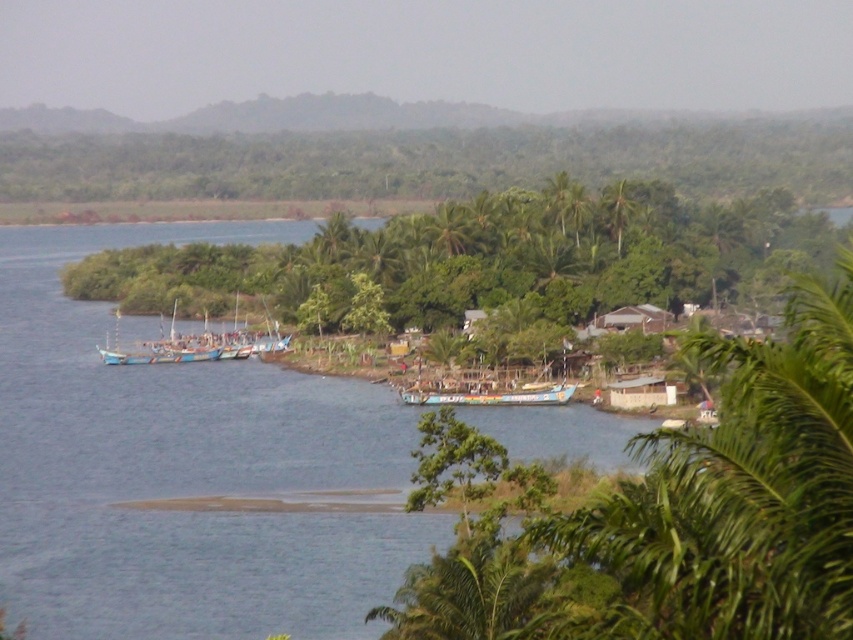
Can you confirm if blue wooden boats at center is positioned above green leafy palm tree at center?

Actually, blue wooden boats at center is below green leafy palm tree at center.

Does blue wooden boats at center have a lesser width compared to green leafy palm tree at center?

No, blue wooden boats at center is not thinner than green leafy palm tree at center.

Measure the distance between point (102, 355) and camera.

A distance of 490.92 feet exists between point (102, 355) and camera.

This screenshot has width=853, height=640. I want to click on blue wooden boats at center, so click(187, 346).

Is blue painted wooden boat at center shorter than green leafy palm tree at center?

Correct, blue painted wooden boat at center is not as tall as green leafy palm tree at center.

Does blue painted wooden boat at center appear under green leafy palm tree at center?

Yes, blue painted wooden boat at center is below green leafy palm tree at center.

Is point (403, 394) positioned after point (618, 243)?

No, it is in front of (618, 243).

Where is `blue painted wooden boat at center`? blue painted wooden boat at center is located at coordinates (492, 396).

Can you confirm if blue wooden boats at center is bigger than blue painted wooden boat at center?

Correct, blue wooden boats at center is larger in size than blue painted wooden boat at center.

Who is more forward, (128, 362) or (413, 394)?

Positioned in front is point (413, 394).

At what (x,y) coordinates should I click in order to perform the action: click on blue wooden boats at center. Please return your answer as a coordinate pair (x, y). This screenshot has width=853, height=640. Looking at the image, I should click on (187, 346).